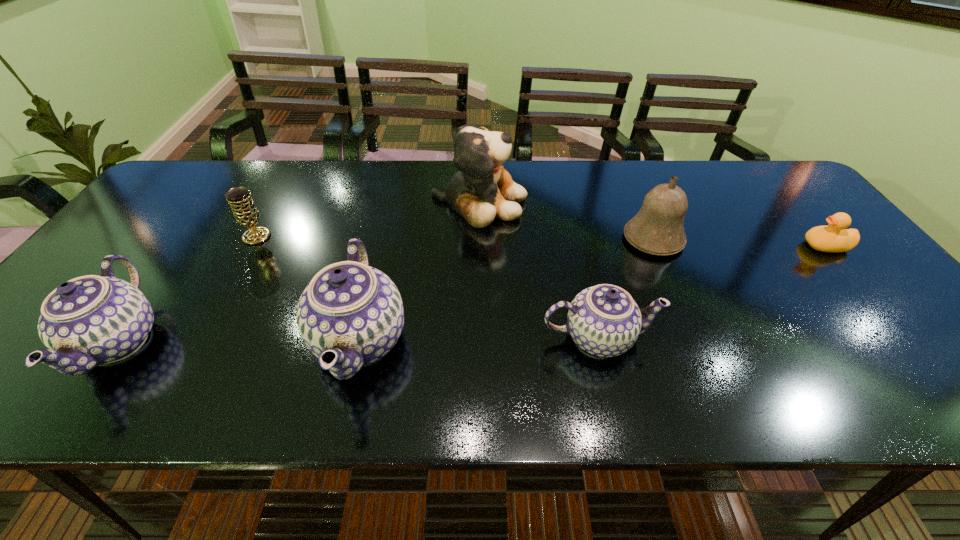
Find the location of `free location located at the spout of the fifth object from right to left`. free location located at the spout of the fifth object from right to left is located at coordinates (205, 340).

Locate an element on the screen. Image resolution: width=960 pixels, height=540 pixels. vacant point located at the spout of the fifth object from right to left is located at coordinates (155, 340).

At what (x,y) coordinates should I click in order to perform the action: click on vacant space located 0.390m at the spout of the fifth object from right to left. Please return your answer as a coordinate pair (x, y). Image resolution: width=960 pixels, height=540 pixels. Looking at the image, I should click on (132, 340).

The height and width of the screenshot is (540, 960). In order to click on blank area located on the back of the chalice in this screenshot , I will do `click(299, 162)`.

Identify the location of vacant space positioned at the face of the puppy. The image size is (960, 540). (567, 202).

Find the location of a particular element. vacant area situated on the right of the second object from right to left is located at coordinates (750, 239).

The height and width of the screenshot is (540, 960). In order to click on vacant space situated 0.070m on the face of the shortest object in this screenshot , I will do `click(778, 246)`.

Locate an element on the screen. Image resolution: width=960 pixels, height=540 pixels. free space located 0.140m on the face of the shortest object is located at coordinates (752, 246).

Identify the location of blank space located on the face of the shortest object. (654, 246).

This screenshot has width=960, height=540. I want to click on object that is positioned at the far edge, so pyautogui.click(x=482, y=189).